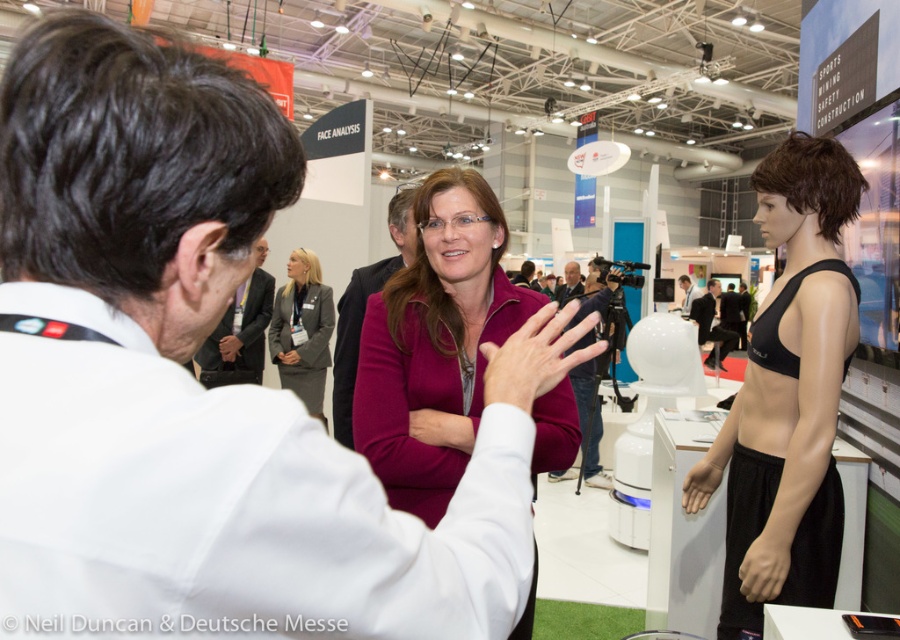
What do you see at coordinates (240, 332) in the screenshot?
I see `matte white ear at upper left` at bounding box center [240, 332].

Which is above, matte white ear at upper left or matte black jacket at center?

matte black jacket at center is above.

The image size is (900, 640). I want to click on matte white ear at upper left, so click(x=240, y=332).

How far apart are gray fabric suit at center and purple matte sweater at center?

They are 5.65 feet apart.

Between gray fabric suit at center and purple matte sweater at center, which one has more height?

Standing taller between the two is gray fabric suit at center.

Does point (291, 284) come in front of point (351, 308)?

No, it is behind (351, 308).

Find the location of a particular element. The height and width of the screenshot is (640, 900). gray fabric suit at center is located at coordinates (302, 330).

Is matte black bra at center thinner than gray fabric suit at center?

No, matte black bra at center is not thinner than gray fabric suit at center.

Does matte black bra at center have a lesser height compared to gray fabric suit at center?

In fact, matte black bra at center may be taller than gray fabric suit at center.

Image resolution: width=900 pixels, height=640 pixels. In order to click on matte black bra at center in this screenshot , I will do `click(788, 396)`.